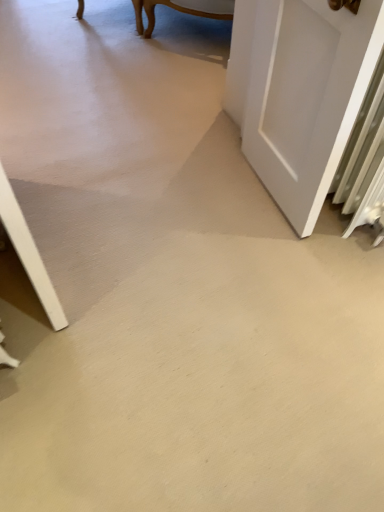
Question: Is white matte door at right inside or outside of smooth concrete floor at center?

Choices:
 (A) inside
 (B) outside

Answer: (B)

Question: From the image's perspective, is white matte door at right positioned above or below smooth concrete floor at center?

Choices:
 (A) below
 (B) above

Answer: (B)

Question: Is white matte door at right wider or thinner than smooth concrete floor at center?

Choices:
 (A) thin
 (B) wide

Answer: (A)

Question: From the image's perspective, relative to white matte door at right, is smooth concrete floor at center above or below?

Choices:
 (A) below
 (B) above

Answer: (A)

Question: Is smooth concrete floor at center wider or thinner than white matte door at right?

Choices:
 (A) wide
 (B) thin

Answer: (A)

Question: Is smooth concrete floor at center inside the boundaries of white matte door at right, or outside?

Choices:
 (A) inside
 (B) outside

Answer: (B)

Question: Does point (329, 420) appear closer or farther from the camera than point (264, 41)?

Choices:
 (A) closer
 (B) farther

Answer: (A)